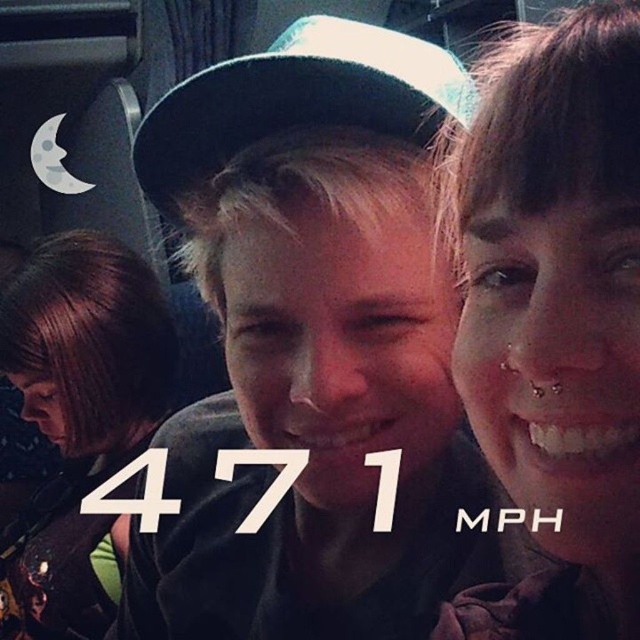
Question: Based on their relative distances, which object is farther from the matte black hat at center?

Choices:
 (A) green fabric baseball cap at center
 (B) matte skin at center
 (C) brown hair at lower left

Answer: (C)

Question: Which point is closer to the camera taking this photo?

Choices:
 (A) (243, 131)
 (B) (627, 324)
 (C) (259, 132)

Answer: (B)

Question: Does matte skin at center have a greater width compared to brown hair at lower left?

Choices:
 (A) yes
 (B) no

Answer: (B)

Question: Which point appears farthest from the camera in this image?

Choices:
 (A) (67, 388)
 (B) (506, 323)
 (C) (164, 435)

Answer: (A)

Question: Considering the relative positions of matte skin at center and green fabric baseball cap at center in the image provided, where is matte skin at center located with respect to green fabric baseball cap at center?

Choices:
 (A) above
 (B) below

Answer: (B)

Question: Does matte skin at center have a larger size compared to green fabric baseball cap at center?

Choices:
 (A) yes
 (B) no

Answer: (A)